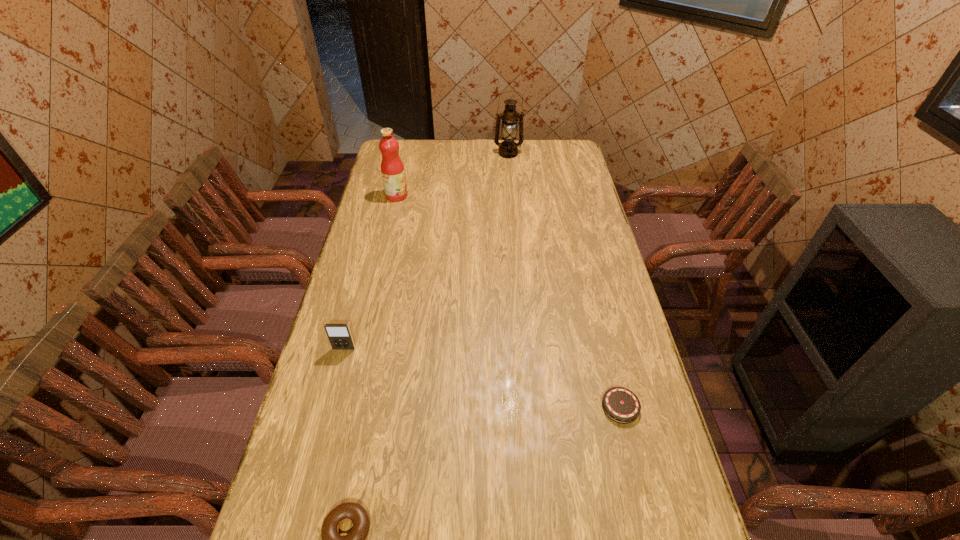
Image resolution: width=960 pixels, height=540 pixels. I want to click on free space between the fourth object from left to right and the fourth farthest object, so click(x=564, y=280).

Find the location of `blank region between the farthest object and the fruit juice`. blank region between the farthest object and the fruit juice is located at coordinates (452, 175).

Where is `vacant area that lies between the fourth object from left to right and the fourth nearest object`? This screenshot has width=960, height=540. vacant area that lies between the fourth object from left to right and the fourth nearest object is located at coordinates (452, 175).

Identify the location of empty space that is in between the third shortest object and the fruit juice. The image size is (960, 540). (371, 272).

The height and width of the screenshot is (540, 960). I want to click on vacant area that lies between the farthest object and the fourth nearest object, so click(x=452, y=175).

Where is `object that is the third closest to the fruit juice`? object that is the third closest to the fruit juice is located at coordinates (621, 405).

At what (x,y) coordinates should I click in order to perform the action: click on object that is the third closest to the iPod. Please return your answer as a coordinate pair (x, y). The width and height of the screenshot is (960, 540). Looking at the image, I should click on (392, 168).

Locate an element on the screen. free location that satisfies the following two spatial constraints: 1. on the front label of the rightmost object; 2. on the left side of the fruit juice is located at coordinates (348, 407).

Find the location of a particular element. Image resolution: width=960 pixels, height=540 pixels. free space that satisfies the following two spatial constraints: 1. on the front label of the fruit juice; 2. on the left side of the rightmost object is located at coordinates (348, 407).

Image resolution: width=960 pixels, height=540 pixels. I want to click on blank space that satisfies the following two spatial constraints: 1. on the front label of the fruit juice; 2. on the back side of the rightmost object, so click(348, 407).